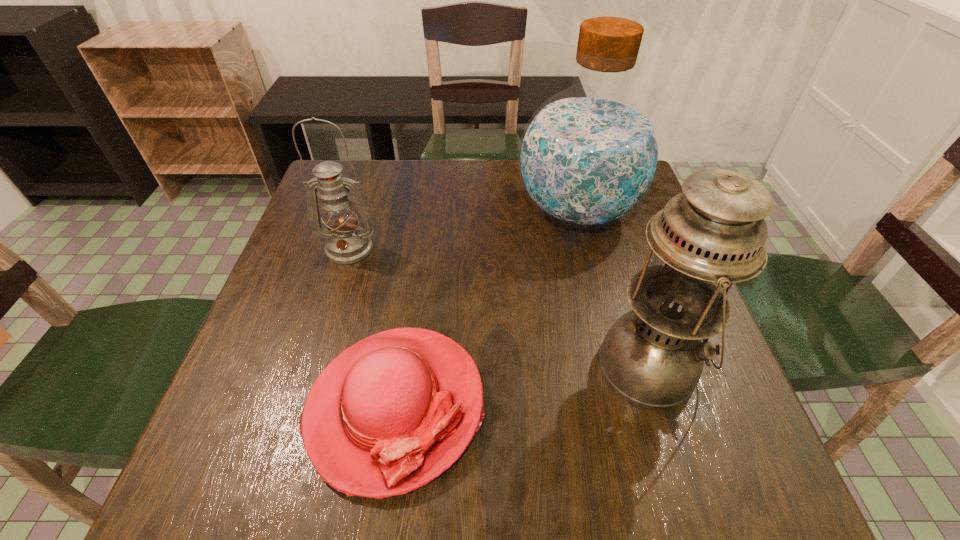
In order to click on unoccupied area between the shorter oil lamp and the water jug in this screenshot , I will do `click(463, 230)`.

The image size is (960, 540). Find the location of `unoccupied position between the shorter oil lamp and the shortest object`. unoccupied position between the shorter oil lamp and the shortest object is located at coordinates (372, 327).

Identify which object is the closest to the taller oil lamp. Please provide its 2D coordinates. Your answer should be formatted as a tuple, i.e. [(x, y)], where the tuple contains the x and y coordinates of a point satisfying the conditions above.

[(389, 414)]

Where is `object that is the closest to the nearer oil lamp`? The height and width of the screenshot is (540, 960). object that is the closest to the nearer oil lamp is located at coordinates (389, 414).